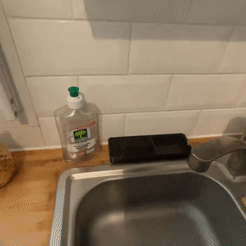
This screenshot has width=246, height=246. Find the location of `white soap bar holder`. white soap bar holder is located at coordinates (191, 154).